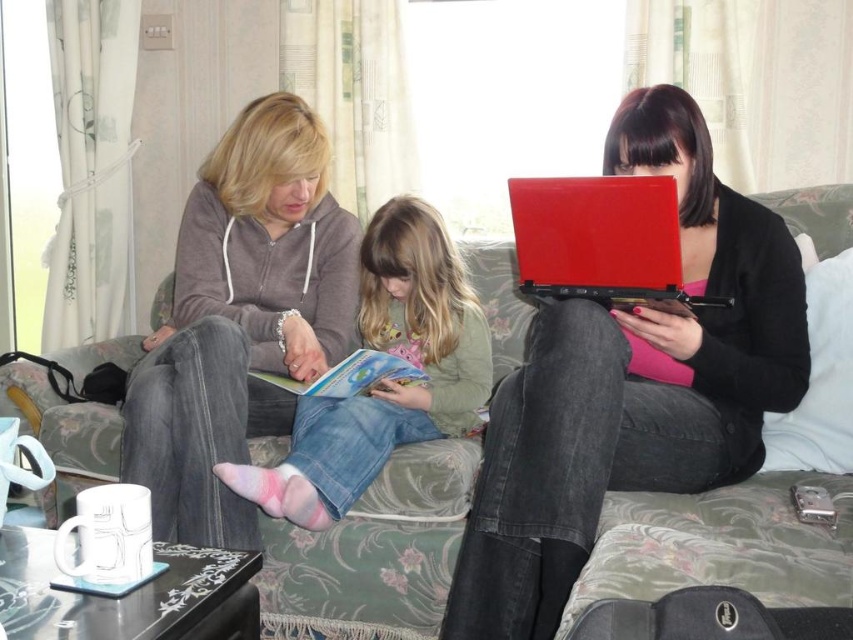
You are a delivery robot that needs to place a small package between the floral fabric couch at center and the denim jeans at center. Can you fit the package there if it measures 10 inches in length?

The distance between the floral fabric couch at center and the denim jeans at center is 10.44 inches. Since the package is 10 inches long, it should fit comfortably within the space available.

You are designing a layout for a small living room and need to place a new sofa and a large decorative pillow. The sofa is the floral fabric couch at center, and the pillow is the matte gray hoodie at center. Given their sizes, which item should you prioritize placing first to ensure they both fit comfortably?

The floral fabric couch at center occupies less space than the matte gray hoodie at center, so you should prioritize placing the larger matte gray hoodie at center first to ensure there is enough space for both items in the small living room.